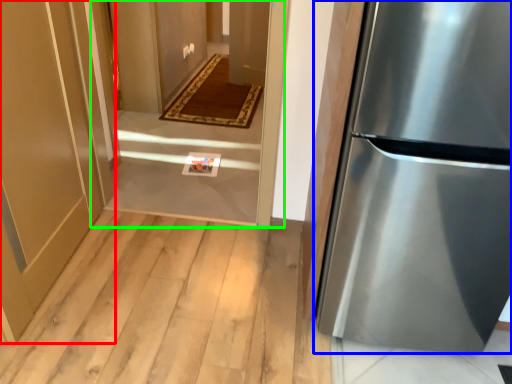
Question: Estimate the real-world distances between objects in this image. Which object is farther from door (highlighted by a red box), refrigerator (highlighted by a blue box) or corridor (highlighted by a green box)?

Choices:
 (A) refrigerator
 (B) corridor

Answer: (A)